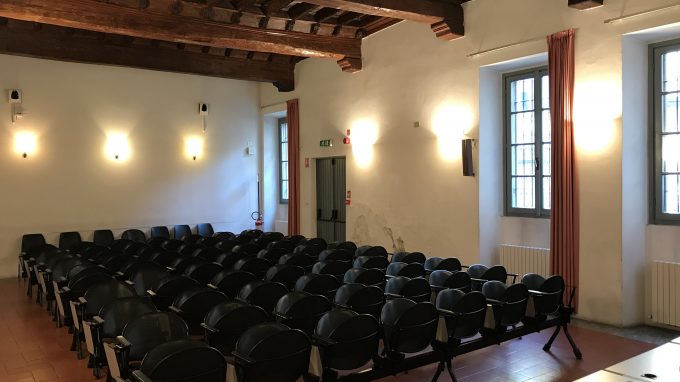
Where is `ceiling`? The image size is (680, 382). ceiling is located at coordinates point(233,58).